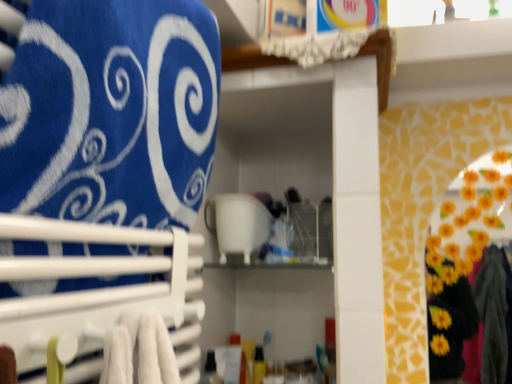
The height and width of the screenshot is (384, 512). What are the coordinates of `white plastic towel rack at left` in the screenshot? It's located at (92, 289).

This screenshot has height=384, width=512. Describe the element at coordinates (92, 289) in the screenshot. I see `white plastic towel rack at left` at that location.

Describe the element at coordinates (111, 112) in the screenshot. The image size is (512, 384). I see `blue fabric towel at upper left` at that location.

Measure the distance between white glossy cup at center and camera.

A distance of 37.61 inches exists between white glossy cup at center and camera.

This screenshot has width=512, height=384. What are the coordinates of `white plastic towel rack at left` in the screenshot? It's located at (92, 289).

Between point (208, 219) and point (98, 147), which one is positioned in front?

Point (98, 147)

Looking at their sizes, would you say white glossy cup at center is wider or thinner than blue fabric towel at upper left?

In the image, white glossy cup at center appears to be wider than blue fabric towel at upper left.

Is white glossy cup at center facing away from blue fabric towel at upper left?

white glossy cup at center does not have its back to blue fabric towel at upper left.

From a real-world perspective, is white glossy cup at center above or below blue fabric towel at upper left?

Clearly, from a real-world perspective, white glossy cup at center is below blue fabric towel at upper left.

Can white plastic towel rack at left be found inside white glossy cup at center?

Definitely not — white plastic towel rack at left is not inside white glossy cup at center.

Is white glossy cup at center not close to white plastic towel rack at left?

Actually, white glossy cup at center and white plastic towel rack at left are a little close together.

Which of these two, white glossy cup at center or white plastic towel rack at left, is thinner?

white plastic towel rack at left.

Considering the sizes of white glossy cup at center and white plastic towel rack at left in the image, is white glossy cup at center taller or shorter than white plastic towel rack at left?

Considering their sizes, white glossy cup at center has more height than white plastic towel rack at left.

From the image's perspective, which object appears higher, white plastic towel rack at left or blue fabric towel at upper left?

blue fabric towel at upper left appears higher in the image.

Is white plastic towel rack at left far from blue fabric towel at upper left?

They are positioned close to each other.

Is white plastic towel rack at left at the right side of blue fabric towel at upper left?

Yes.

How different are the orientations of blue fabric towel at upper left and white plastic towel rack at left in degrees?

The angle between the facing direction of blue fabric towel at upper left and the facing direction of white plastic towel rack at left is 0.00524 degrees.

From the image's perspective, which is below, blue fabric towel at upper left or white plastic towel rack at left?

white plastic towel rack at left is shown below in the image.

Does blue fabric towel at upper left have a greater width compared to white plastic towel rack at left?

Indeed, blue fabric towel at upper left has a greater width compared to white plastic towel rack at left.

Is blue fabric towel at upper left facing towards white plastic towel rack at left?

Yes, blue fabric towel at upper left is facing white plastic towel rack at left.

Consider the image. From a real-world perspective, which object stands above the other?

blue fabric towel at upper left, from a real-world perspective.

In the scene shown: Is blue fabric towel at upper left facing away from white glossy cup at center?

No, blue fabric towel at upper left is not facing away from white glossy cup at center.

Which of these two, blue fabric towel at upper left or white glossy cup at center, is bigger?

blue fabric towel at upper left.

Consider the image. From the image's perspective, does blue fabric towel at upper left appear lower than white glossy cup at center?

Incorrect, from the image's perspective, blue fabric towel at upper left is higher than white glossy cup at center.

How distant is white plastic towel rack at left from white glossy cup at center?

A distance of 14.52 inches exists between white plastic towel rack at left and white glossy cup at center.

Does white plastic towel rack at left appear on the right side of white glossy cup at center?

No.

Considering the relative sizes of white plastic towel rack at left and white glossy cup at center in the image provided, is white plastic towel rack at left shorter than white glossy cup at center?

Yes.

Is white plastic towel rack at left with white glossy cup at center?

No, white plastic towel rack at left is not beside white glossy cup at center.

Locate an element on the screen. bath towel in front of the white glossy cup at center is located at coordinates (111, 112).

At what (x,y) coordinates should I click in order to perform the action: click on appliance that appears above the white plastic towel rack at left (from the image's perspective). Please return your answer as a coordinate pair (x, y). Image resolution: width=512 pixels, height=384 pixels. Looking at the image, I should click on click(x=238, y=224).

Considering their positions, is white glossy cup at center positioned further to white plastic towel rack at left than blue fabric towel at upper left?

white glossy cup at center is further to white plastic towel rack at left.

From the image, which object appears to be farther from white plastic towel rack at left, blue fabric towel at upper left or white glossy cup at center?

Based on the image, white glossy cup at center appears to be further to white plastic towel rack at left.

Which object lies nearer to the anchor point white glossy cup at center, white plastic towel rack at left or blue fabric towel at upper left?

The object closer to white glossy cup at center is white plastic towel rack at left.

Looking at the image, which one is located further to blue fabric towel at upper left, white plastic towel rack at left or white glossy cup at center?

white glossy cup at center lies further to blue fabric towel at upper left than the other object.

Consider the image. Considering their positions, is blue fabric towel at upper left positioned closer to white glossy cup at center than white plastic towel rack at left?

white plastic towel rack at left lies closer to white glossy cup at center than the other object.

From the image, which object appears to be nearer to blue fabric towel at upper left, white glossy cup at center or white plastic towel rack at left?

Among the two, white plastic towel rack at left is located nearer to blue fabric towel at upper left.

The image size is (512, 384). Find the location of `bath towel between white plastic towel rack at left and white glossy cup at center along the z-axis`. bath towel between white plastic towel rack at left and white glossy cup at center along the z-axis is located at coordinates (x=111, y=112).